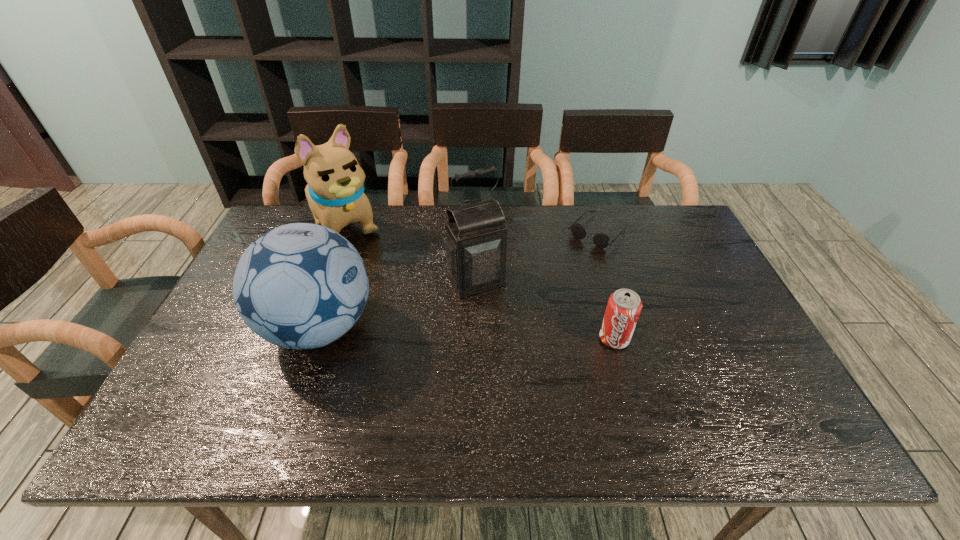
This screenshot has width=960, height=540. What are the coordinates of `vacant position located 0.400m on the front-facing side of the shortest object` in the screenshot? It's located at (512, 325).

Find the location of a particular element. free space located 0.170m on the front-facing side of the shortest object is located at coordinates (556, 277).

Locate an element on the screen. This screenshot has height=540, width=960. free space located 0.260m on the front-facing side of the shortest object is located at coordinates (540, 294).

Locate an element on the screen. blank space located 0.240m on the front-facing side of the lantern is located at coordinates (526, 363).

Where is `free spot located on the front-facing side of the lantern`? The image size is (960, 540). free spot located on the front-facing side of the lantern is located at coordinates (550, 403).

Find the location of `blank area located on the front-facing side of the lantern`. blank area located on the front-facing side of the lantern is located at coordinates (528, 366).

Find the location of `puppy located in the far edge section of the desktop`. puppy located in the far edge section of the desktop is located at coordinates (335, 192).

You are a GUI agent. You are given a task and a screenshot of the screen. Output one action in this format:
    pyautogui.click(x=<x>, y=<y>)
    Task: Click on the sunglasses that is at the far edge
    This screenshot has height=540, width=960.
    Given the screenshot: What is the action you would take?
    pyautogui.click(x=601, y=240)

I want to click on object positioned at the near edge, so click(300, 286).

Find the location of `soccer ball that is at the left edge`. soccer ball that is at the left edge is located at coordinates (300, 286).